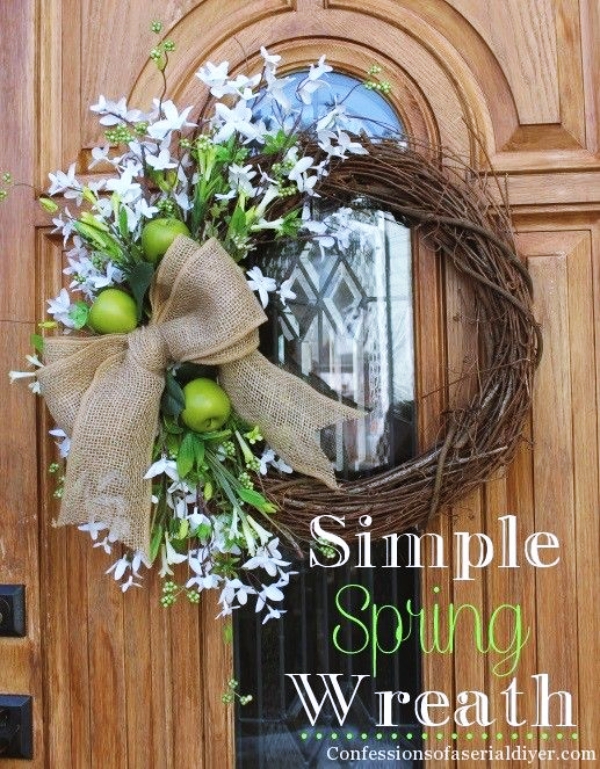
This screenshot has width=600, height=769. I want to click on rough fabric bow, so click(x=147, y=358).